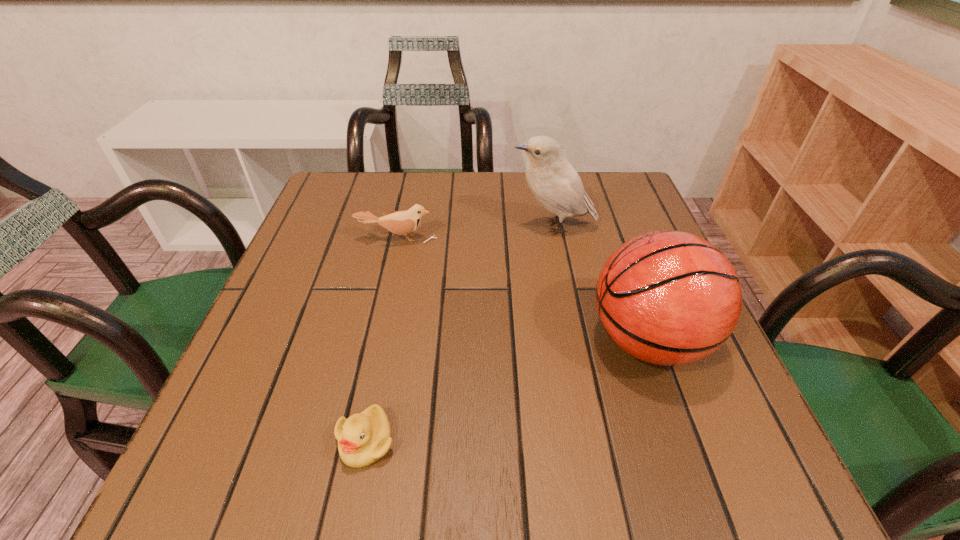
Image resolution: width=960 pixels, height=540 pixels. In order to click on blank space at the near edge in this screenshot , I will do `click(483, 469)`.

Locate an element on the screen. Image resolution: width=960 pixels, height=540 pixels. free space at the left edge of the desktop is located at coordinates (334, 264).

I want to click on free space at the right edge of the desktop, so click(x=636, y=375).

The width and height of the screenshot is (960, 540). Identify the location of free point at the far left corner. (312, 215).

What are the coordinates of `vacant region at the near left corner of the desktop` in the screenshot? It's located at (221, 438).

Locate an element on the screen. The image size is (960, 540). free space at the far right corner of the desktop is located at coordinates (636, 199).

Locate an element on the screen. vacant area that lies between the shorter bird and the nearest object is located at coordinates (381, 340).

Locate an element on the screen. free space between the left bird and the taller bird is located at coordinates (475, 233).

This screenshot has height=540, width=960. Identify the location of unoccupied area between the basketball and the nearest object. (507, 390).

Locate an element on the screen. This screenshot has height=540, width=960. free space between the right bird and the shorter bird is located at coordinates (475, 233).